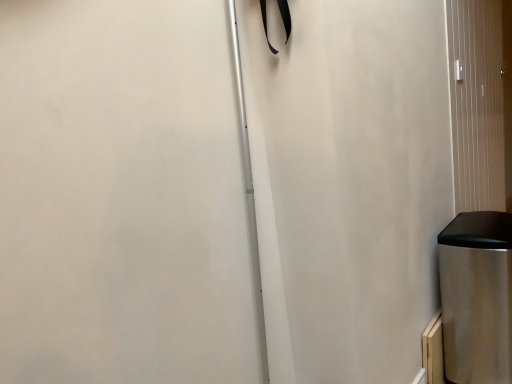
Question: Is stainless steel trash can at lower right wider or thinner than metallic silver screen door at right?

Choices:
 (A) thin
 (B) wide

Answer: (B)

Question: In the image, is stainless steel trash can at lower right positioned in front of or behind metallic silver screen door at right?

Choices:
 (A) front
 (B) behind

Answer: (A)

Question: Looking at the image, does stainless steel trash can at lower right seem bigger or smaller compared to metallic silver screen door at right?

Choices:
 (A) big
 (B) small

Answer: (B)

Question: Is metallic silver screen door at right wider or thinner than stainless steel trash can at lower right?

Choices:
 (A) thin
 (B) wide

Answer: (A)

Question: Is point (470, 67) positioned closer to the camera than point (455, 289)?

Choices:
 (A) farther
 (B) closer

Answer: (A)

Question: Considering the relative positions of metallic silver screen door at right and stainless steel trash can at lower right in the image provided, is metallic silver screen door at right to the left or to the right of stainless steel trash can at lower right?

Choices:
 (A) right
 (B) left

Answer: (A)

Question: From their relative heights in the image, would you say metallic silver screen door at right is taller or shorter than stainless steel trash can at lower right?

Choices:
 (A) tall
 (B) short

Answer: (A)